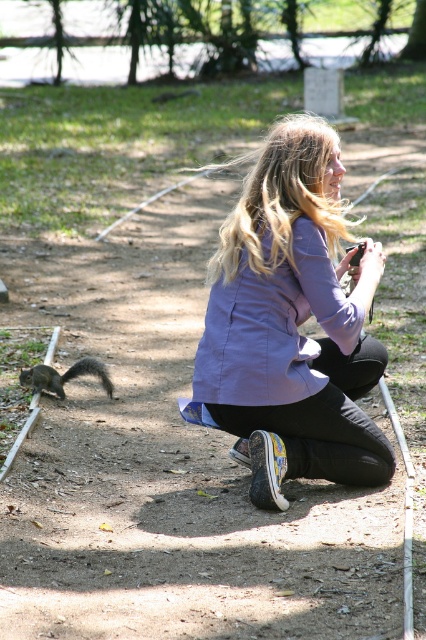
Locate an element on the screen. This screenshot has height=640, width=426. purple matte jacket at center is located at coordinates (293, 323).

Between point (311, 221) and point (54, 387), which one is positioned in front?

Positioned in front is point (311, 221).

Locate an element on the screen. The width and height of the screenshot is (426, 640). purple matte jacket at center is located at coordinates (293, 323).

Is purple cotton jacket at center to the right of gray furry squirrel at lower left from the viewer's perspective?

Yes, purple cotton jacket at center is to the right of gray furry squirrel at lower left.

Does point (261, 282) come in front of point (111, 392)?

Yes, it is in front of point (111, 392).

Which is in front, point (302, 266) or point (39, 385)?

Positioned in front is point (302, 266).

At what (x,y) coordinates should I click in order to perform the action: click on purple cotton jacket at center. Please return your answer as a coordinate pair (x, y). Looking at the image, I should click on (273, 328).

Who is more forward, (325, 380) or (279, 401)?

Point (279, 401) is more forward.

Is point (379, 369) farther from viewer compared to point (233, 278)?

That is True.

Locate an element on the screen. Image resolution: width=426 pixels, height=640 pixels. purple matte jacket at center is located at coordinates (293, 323).